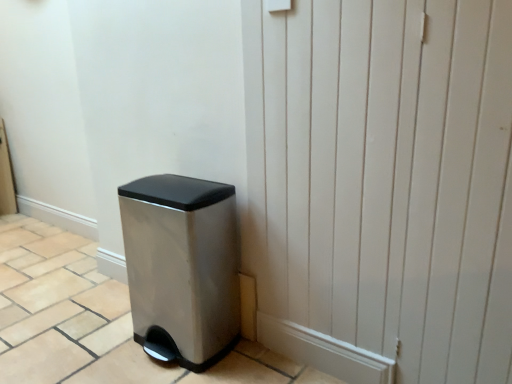
Locate an element on the screen. The width and height of the screenshot is (512, 384). free point below satin silver trash can at lower left (from a real-world perspective) is located at coordinates (199, 360).